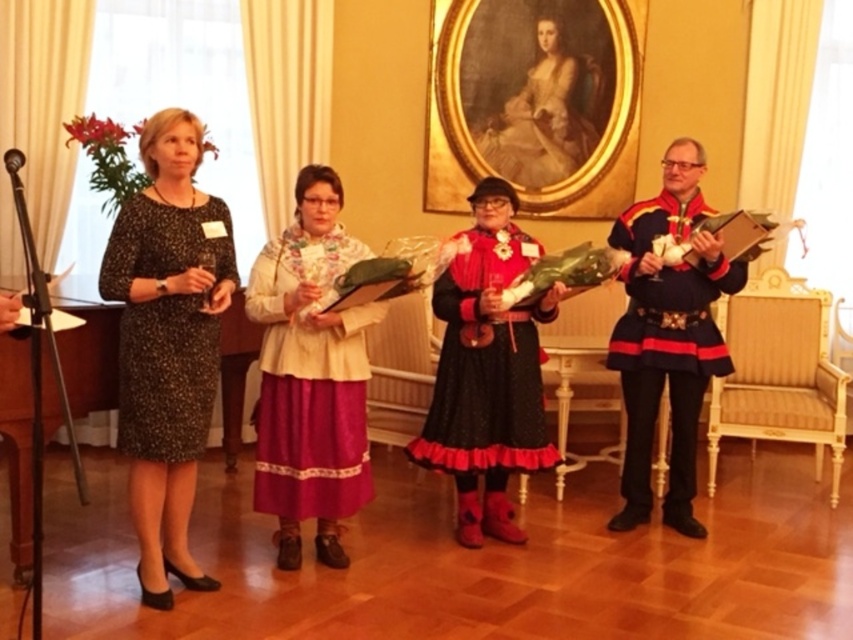
You are standing at the entrance of the room and want to walk towards the two points marked in the image. Which point, point (194, 154) or point (490, 147), would you reach first?

Point (194, 154) is in front of point (490, 147), so you would reach point (194, 154) first.

You are a photographer at the event and need to decide which outfit to feature in the magazine spread. The editor prefers wider skirts or dresses. Based on the image, which of the two outfits should you choose between the black dotted dress at left and the silky pink skirt at center?

The silky pink skirt at center is wider than the black dotted dress at left, so you should choose the silky pink skirt at center for the magazine spread as it meets the editor preference for wider skirts or dresses.